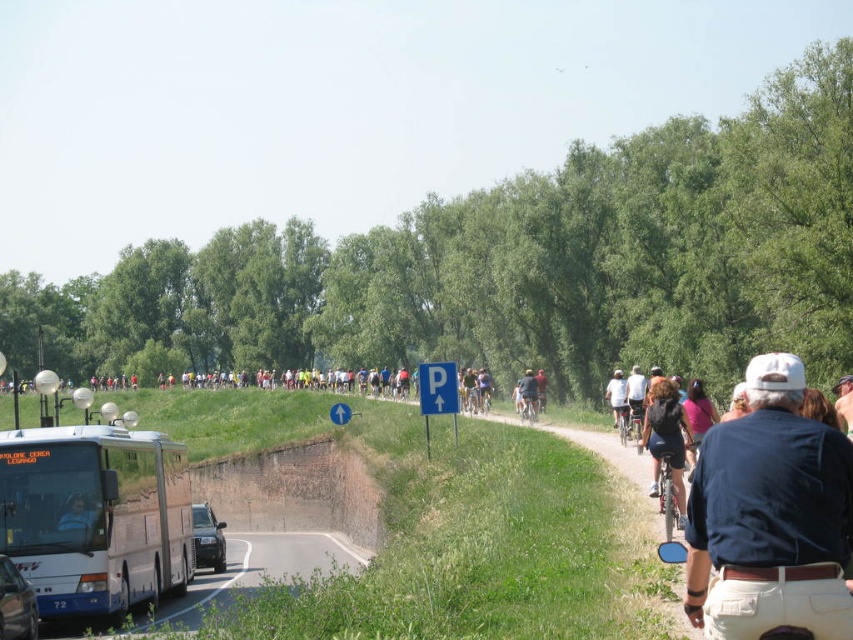
In the scene shown: You are a cyclist participating in a race and you see two points marked on the road ahead of you. The first point is at coordinate point (665, 410) and the second point is at coordinate point (619, 381). Which point is closer to your current position?

Point (665, 410) is in front of point (619, 381), so the first point is closer to your current position.

You are a participant in a cycling event and need to locate your bicycle, the shiny metallic bicycle at right, which is positioned at a specific coordinate. Given that the coordinate system starts at the bottom left corner of the image, with x increasing to the right and y increasing upwards, can you determine whether your bicycle is closer to the top or bottom half of the image?

The shiny metallic bicycle at right is positioned at point 0.783 on the y axis, which is above the midpoint of the image. Therefore, the shiny metallic bicycle at right is closer to the top half of the image.

You are a cyclist participating in a race and you see the white matte bus at lower left and the dark blue shirt at center. Which object is positioned more to the left side of the scene?

The white matte bus at lower left is positioned more to the left side of the scene than the dark blue shirt at center.